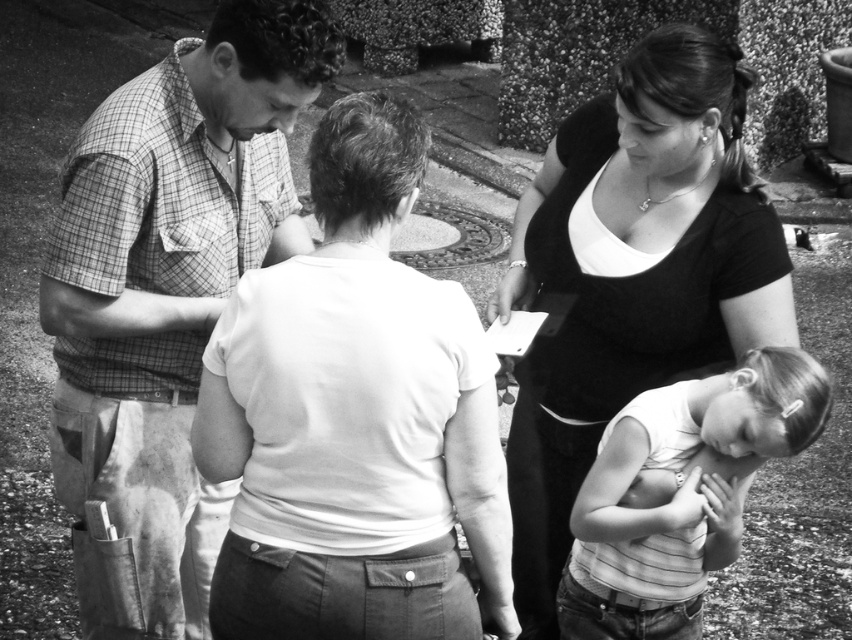
Can you confirm if matte black shirt at center is thinner than white striped tank top at lower right?

No.

What are the coordinates of `matte black shirt at center` in the screenshot? It's located at (631, 275).

Where is `matte black shirt at center`? Image resolution: width=852 pixels, height=640 pixels. matte black shirt at center is located at coordinates (631, 275).

What are the coordinates of `matte black shirt at center` in the screenshot? It's located at (631, 275).

Can you confirm if checkered fabric shirt at left is taller than matte black shirt at center?

Incorrect, checkered fabric shirt at left's height is not larger of matte black shirt at center's.

Which is behind, point (325, 8) or point (551, 356)?

Positioned behind is point (551, 356).

Find the location of a particular element. This screenshot has width=852, height=640. checkered fabric shirt at left is located at coordinates (170, 284).

Measure the distance from checkered fabric shirt at left to white striped tank top at lower right.

A distance of 4.35 feet exists between checkered fabric shirt at left and white striped tank top at lower right.

Which is in front, point (176, 627) or point (832, 388)?

Point (832, 388) is more forward.

The height and width of the screenshot is (640, 852). Describe the element at coordinates (170, 284) in the screenshot. I see `checkered fabric shirt at left` at that location.

Locate an element on the screen. This screenshot has height=640, width=852. checkered fabric shirt at left is located at coordinates (170, 284).